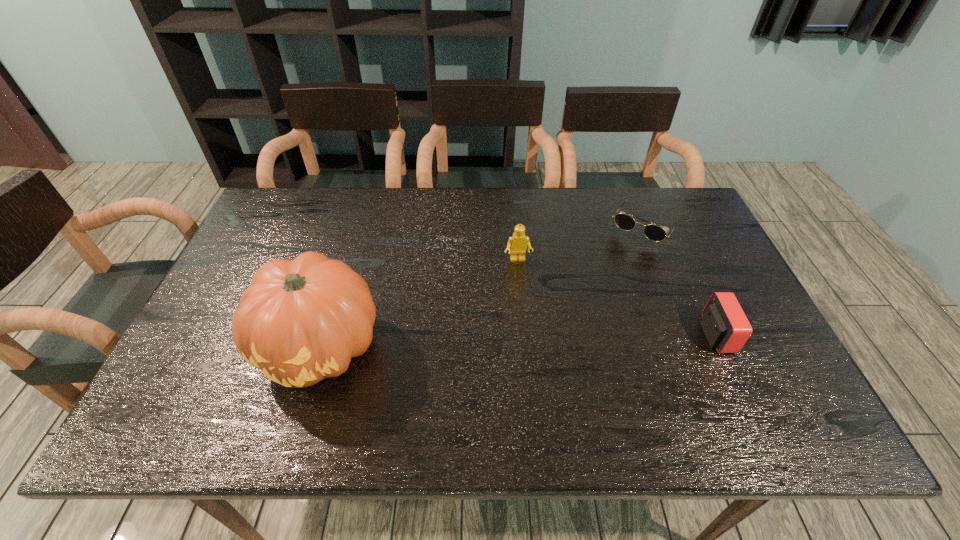
The height and width of the screenshot is (540, 960). Identify the location of free space on the desktop that is between the tallest object and the alarm clock and is positioned on the face of the second object from left to right. [531, 341].

Locate an element on the screen. free spot on the desktop that is between the tallest object and the alarm clock and is positioned on the front lenses of the farthest object is located at coordinates (571, 340).